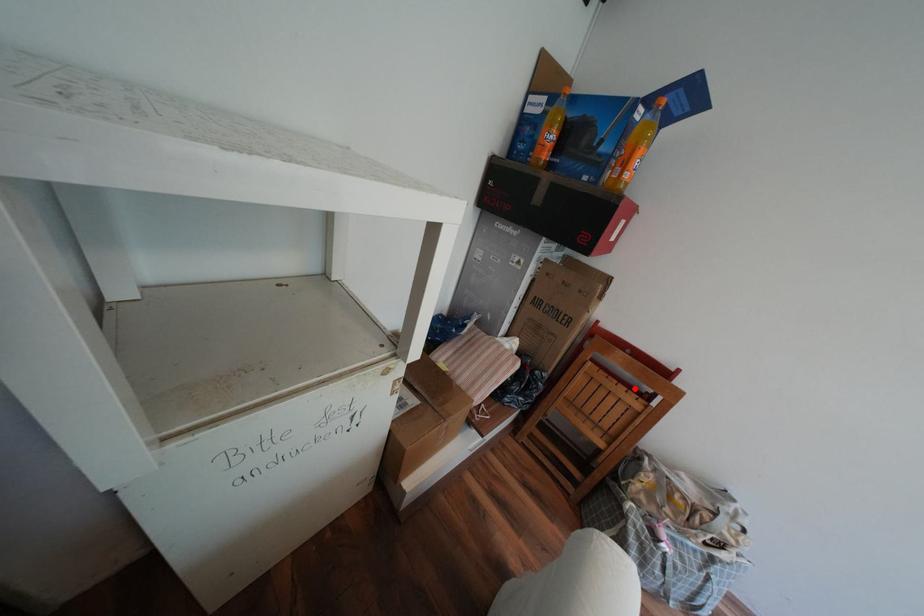
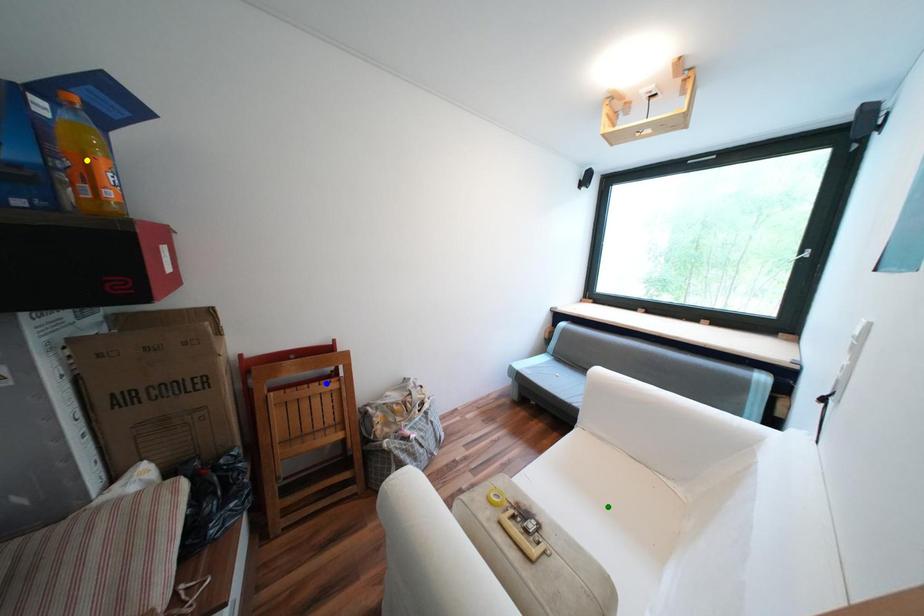
Question: I am providing you with two images of the same scene from different viewpoints. A red point is marked on the first image. You are given multiple points on the second image. Can you choose the point in image 2 that corresponds to the point in image 1?

Choices:
 (A) green point
 (B) blue point
 (C) yellow point

Answer: (B)